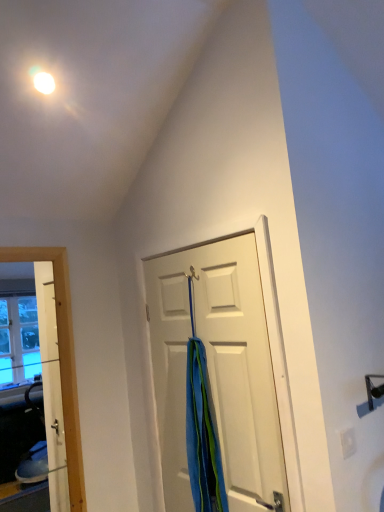
Question: From a real-world perspective, is blue fabric shower curtain at center physically located above or below white matte door at center?

Choices:
 (A) below
 (B) above

Answer: (A)

Question: From the image's perspective, relative to white matte door at center, is blue fabric shower curtain at center above or below?

Choices:
 (A) below
 (B) above

Answer: (A)

Question: Looking at their shapes, would you say blue fabric shower curtain at center is wider or thinner than white matte door at center?

Choices:
 (A) wide
 (B) thin

Answer: (A)

Question: Considering the relative positions of white matte door at center and blue fabric shower curtain at center in the image provided, is white matte door at center to the left or to the right of blue fabric shower curtain at center?

Choices:
 (A) left
 (B) right

Answer: (B)

Question: In terms of size, does white matte door at center appear bigger or smaller than blue fabric shower curtain at center?

Choices:
 (A) small
 (B) big

Answer: (B)

Question: From the image's perspective, is white matte door at center above or below blue fabric shower curtain at center?

Choices:
 (A) above
 (B) below

Answer: (A)

Question: From a real-world perspective, is white matte door at center physically located above or below blue fabric shower curtain at center?

Choices:
 (A) above
 (B) below

Answer: (A)